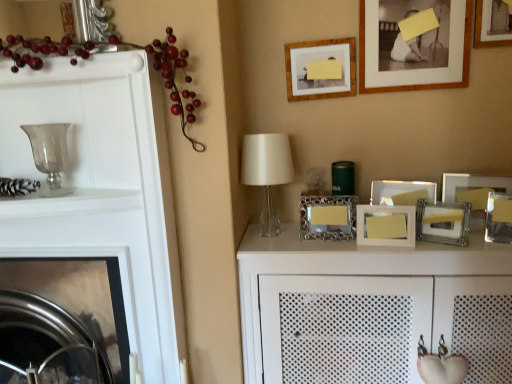
Find the location of a particular element. This screenshot has height=384, width=512. empty space that is to the right of wooden picture frame at center-right, the 9th picture frame from the top is located at coordinates (440, 245).